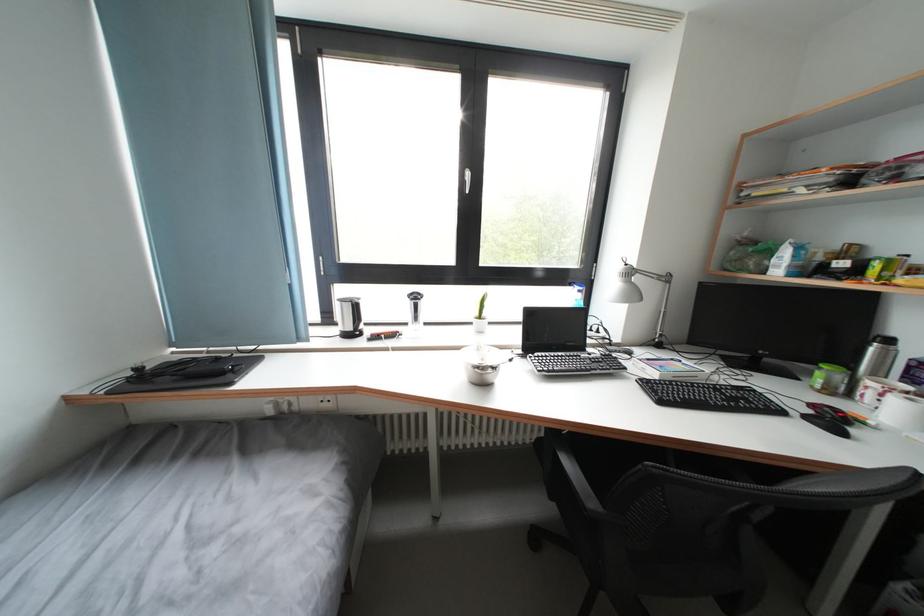
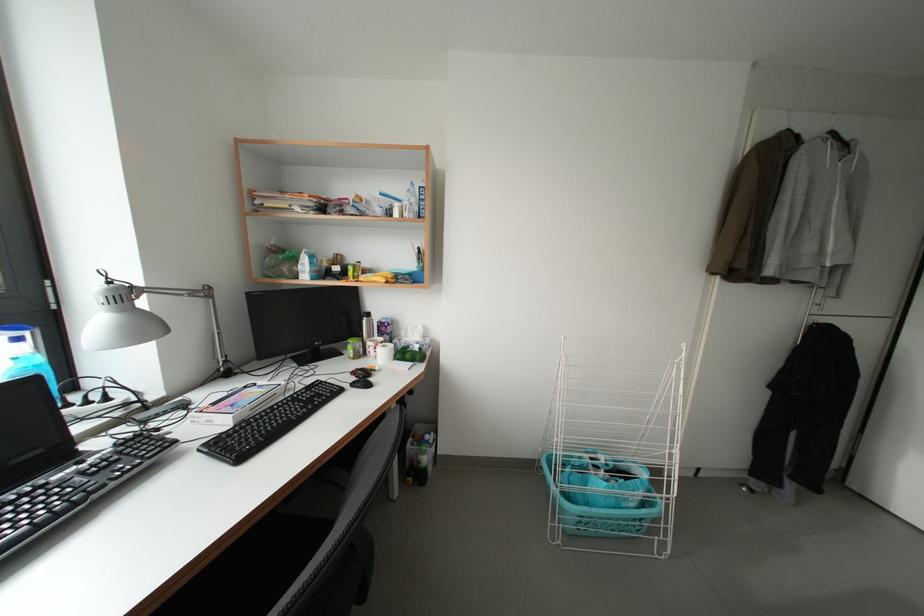
Question: The camera is either moving clockwise (left) or counter-clockwise (right) around the object. The first image is from the beginning of the video and the second image is from the end. Is the camera moving left or right when shooting the video?

Choices:
 (A) Left
 (B) Right

Answer: (A)